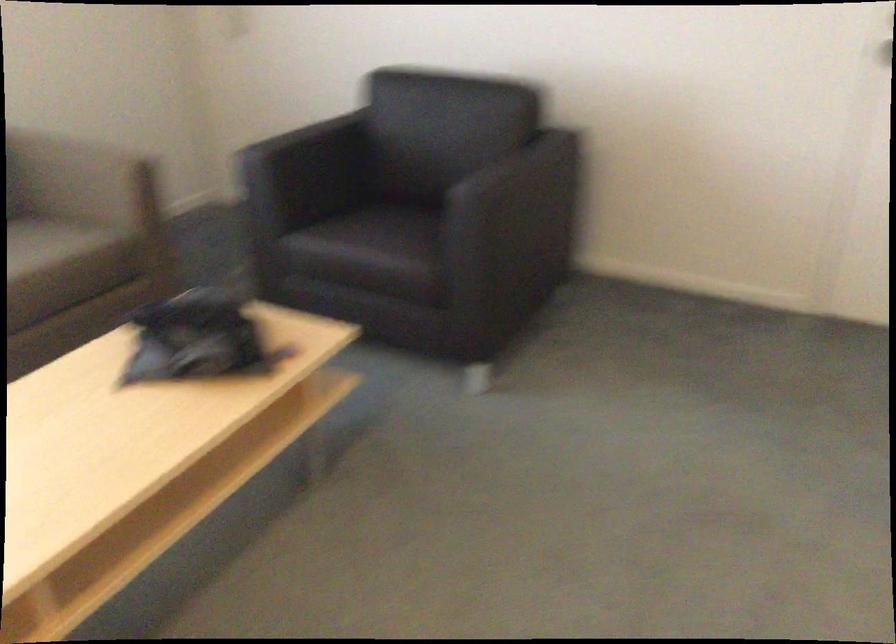
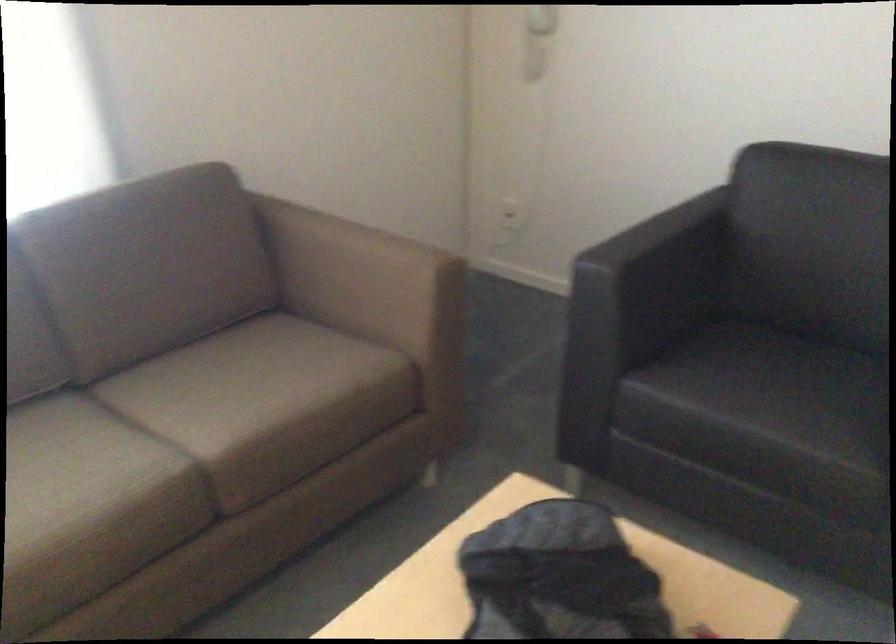
In the second image, find the point that corresponds to pixel 304 158 in the first image.

(652, 270)